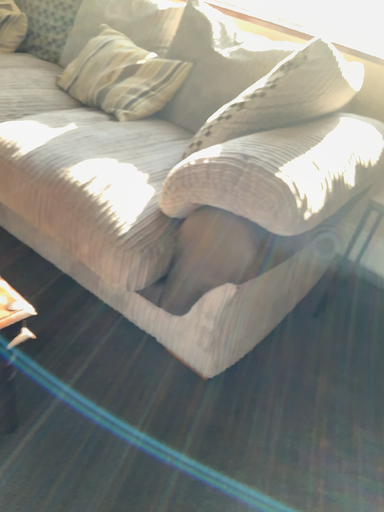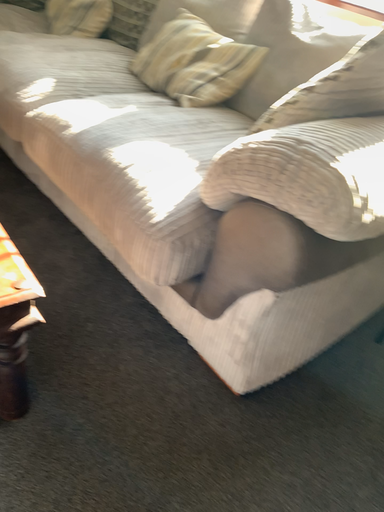
Question: How did the camera likely rotate when shooting the video?

Choices:
 (A) rotated left
 (B) rotated right

Answer: (A)